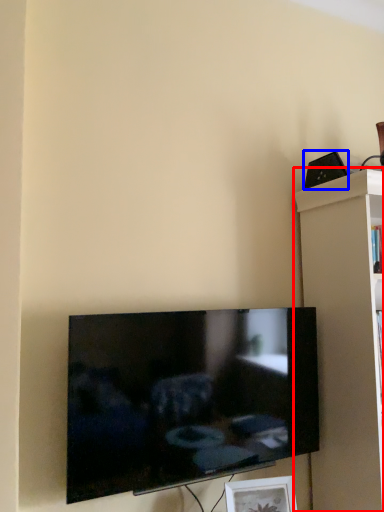
Question: Which object is closer to the camera taking this photo, shelf (highlighted by a red box) or speaker (highlighted by a blue box)?

Choices:
 (A) shelf
 (B) speaker

Answer: (A)